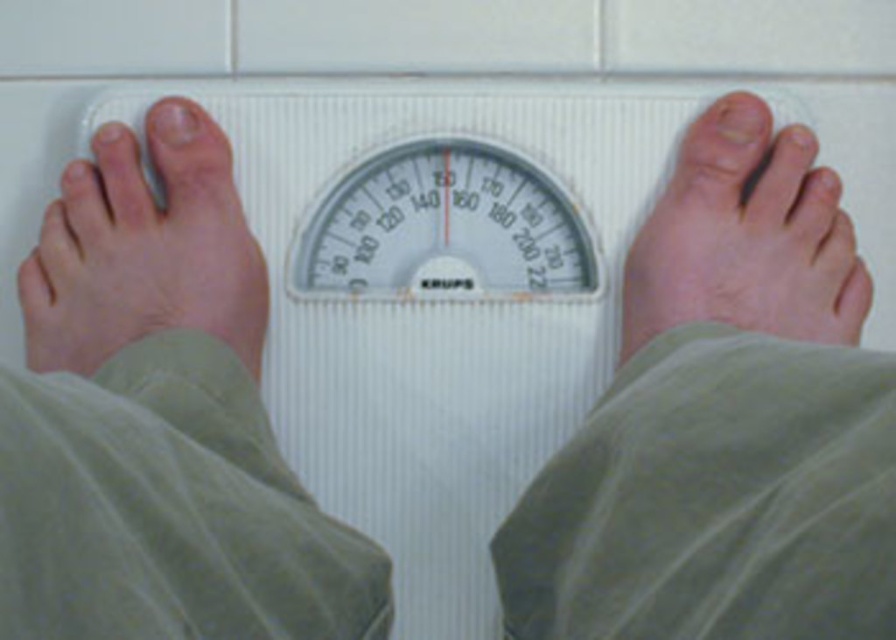
Question: Does white plastic scale at center appear over skinny white foot at center?

Choices:
 (A) yes
 (B) no

Answer: (A)

Question: Does skinny flesh-toned foot at left have a larger size compared to skinny white foot at center?

Choices:
 (A) yes
 (B) no

Answer: (B)

Question: Is skinny flesh-toned foot at left to the right of skinny white foot at center from the viewer's perspective?

Choices:
 (A) yes
 (B) no

Answer: (B)

Question: Which point appears closest to the camera in this image?

Choices:
 (A) (696, 296)
 (B) (233, 244)

Answer: (A)

Question: Which point is farther from the camera taking this photo?

Choices:
 (A) (266, 291)
 (B) (330, 177)
 (C) (820, 228)

Answer: (B)

Question: Which of the following is the farthest from the observer?

Choices:
 (A) (804, 296)
 (B) (569, 99)
 (C) (128, 298)

Answer: (B)